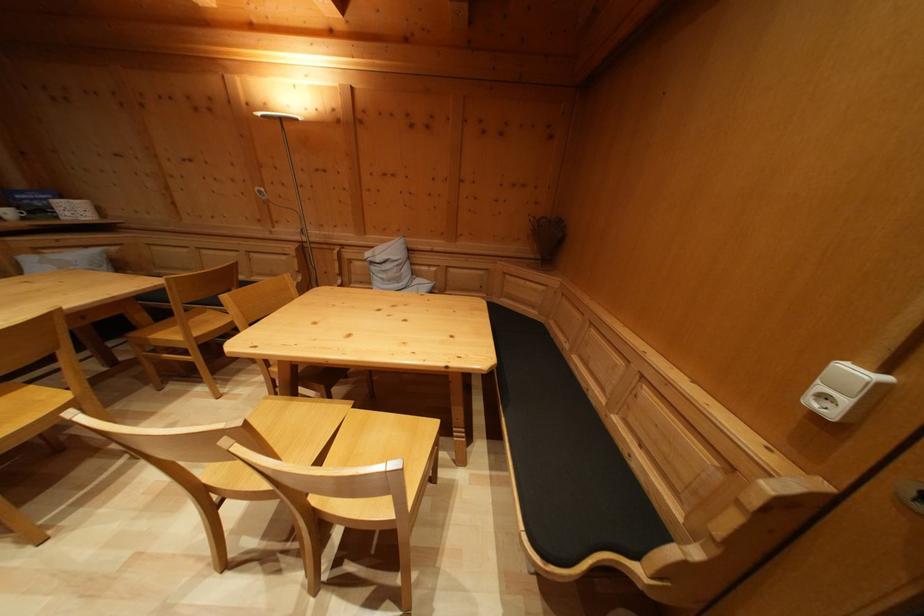
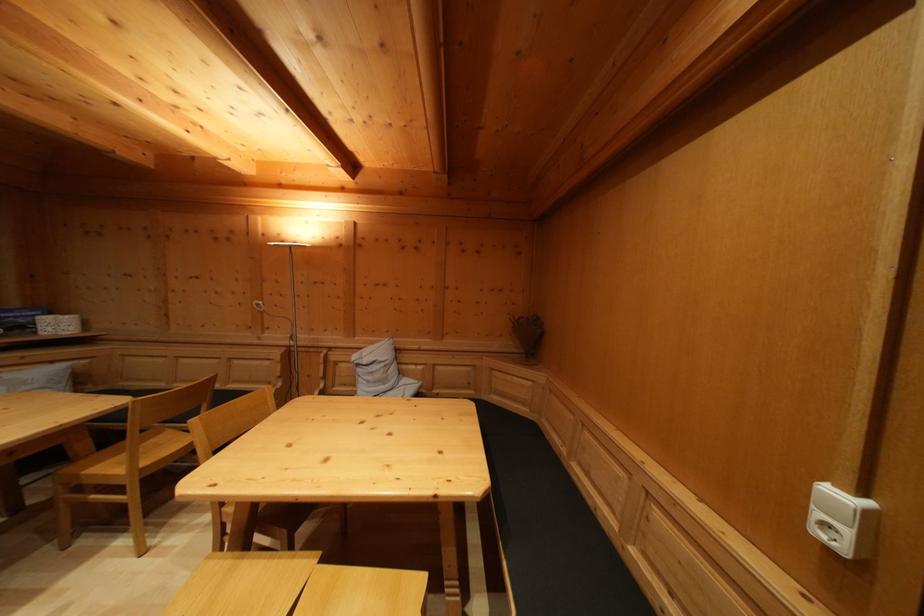
Question: In a continuous first-person perspective shot, in which direction is the camera moving?

Choices:
 (A) Left
 (B) Right
 (C) Forward
 (D) Backward

Answer: (D)